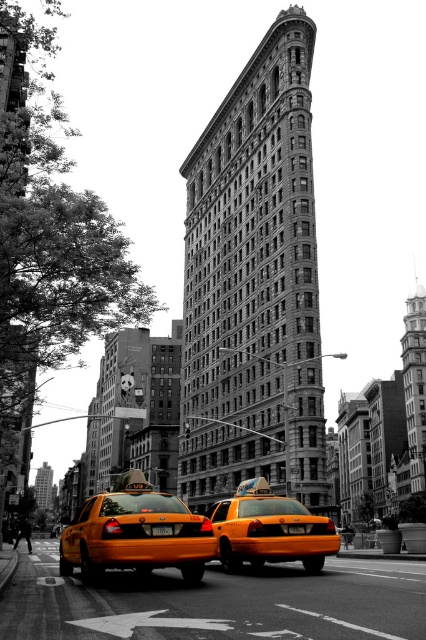
Question: Can you confirm if yellow matte taxi at lower center is thinner than shiny yellow taxi at center?

Choices:
 (A) no
 (B) yes

Answer: (A)

Question: Which point is closer to the camera taking this photo?

Choices:
 (A) (238, 547)
 (B) (129, 554)

Answer: (B)

Question: In this image, where is yellow matte taxi at lower center located relative to shiny yellow taxi at center?

Choices:
 (A) above
 (B) below

Answer: (B)

Question: Can you confirm if yellow matte taxi at lower center is bigger than shiny yellow taxi at center?

Choices:
 (A) yes
 (B) no

Answer: (A)

Question: Which point appears closest to the camera in this image?

Choices:
 (A) (143, 506)
 (B) (261, 509)

Answer: (A)

Question: Which of the following is the farthest from the observer?

Choices:
 (A) (249, 509)
 (B) (58, 561)

Answer: (B)